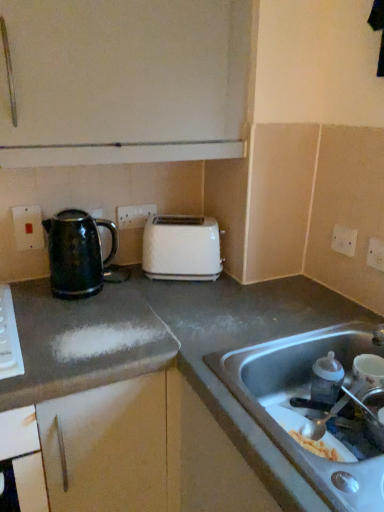
Question: Which direction should I rotate to look at gray matte countertop at center, which appears as the 1th countertop when viewed from the right, — up or down?

Choices:
 (A) up
 (B) down

Answer: (B)

Question: Is shiny metallic kettle at center-left, placed as the 1th countertop when sorted from left to right, positioned far away from white plastic electric outlet at upper right, which appears as the 3th electric outlet when viewed from the left?

Choices:
 (A) no
 (B) yes

Answer: (A)

Question: Can you confirm if shiny metallic kettle at center-left, placed as the 1th countertop when sorted from left to right, is shorter than white plastic electric outlet at upper right, marked as the 2th electric outlet in a right-to-left arrangement?

Choices:
 (A) yes
 (B) no

Answer: (B)

Question: Does shiny metallic kettle at center-left, placed as the 1th countertop when sorted from left to right, have a greater width compared to white plastic electric outlet at upper right, which is the second electric outlet in front-to-back order?

Choices:
 (A) yes
 (B) no

Answer: (A)

Question: Is shiny metallic kettle at center-left, placed as the 1th countertop when sorted from left to right, outside white plastic electric outlet at upper right, which is the second electric outlet in front-to-back order?

Choices:
 (A) no
 (B) yes

Answer: (B)

Question: Is shiny metallic kettle at center-left, which is the second countertop in right-to-left order, smaller than white plastic electric outlet at upper right, which is the second electric outlet in front-to-back order?

Choices:
 (A) no
 (B) yes

Answer: (A)

Question: Is shiny metallic kettle at center-left, placed as the 1th countertop when sorted from left to right, at the right side of white plastic electric outlet at upper right, marked as the 2th electric outlet in a right-to-left arrangement?

Choices:
 (A) no
 (B) yes

Answer: (A)

Question: Is gray matte countertop at center, the second countertop positioned from the left, smaller than shiny metallic kettle at left?

Choices:
 (A) no
 (B) yes

Answer: (A)

Question: From the image's perspective, is gray matte countertop at center, the second countertop positioned from the left, below shiny metallic kettle at left?

Choices:
 (A) yes
 (B) no

Answer: (A)

Question: Is gray matte countertop at center, the second countertop positioned from the left, at the left side of shiny metallic kettle at left?

Choices:
 (A) no
 (B) yes

Answer: (A)

Question: From the image's perspective, is gray matte countertop at center, the second countertop positioned from the left, located above shiny metallic kettle at left?

Choices:
 (A) yes
 (B) no

Answer: (B)

Question: Are gray matte countertop at center, which appears as the 1th countertop when viewed from the right, and shiny metallic kettle at left beside each other?

Choices:
 (A) no
 (B) yes

Answer: (A)

Question: Is shiny metallic kettle at left inside gray matte countertop at center, the second countertop positioned from the left?

Choices:
 (A) yes
 (B) no

Answer: (B)

Question: Are white plastic electric outlet at center, marked as the 3th electric outlet in a right-to-left arrangement, and white plastic electric outlet at upper right, marked as the 2th electric outlet in a right-to-left arrangement, far apart?

Choices:
 (A) no
 (B) yes

Answer: (A)